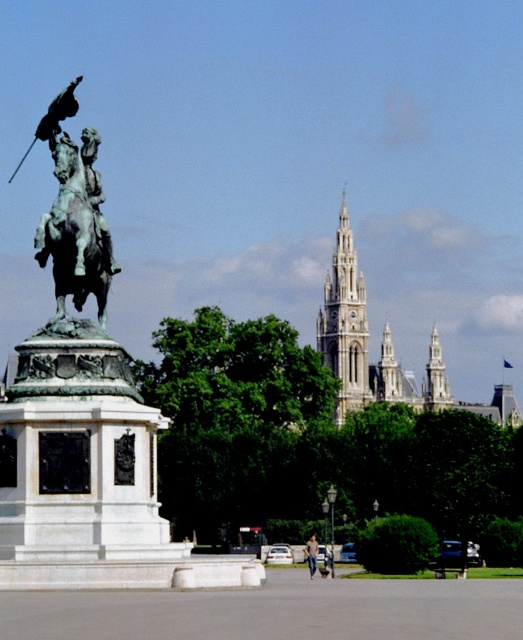
Question: Does bronze statue at left appear on the left side of dark blue jeans at center?

Choices:
 (A) no
 (B) yes

Answer: (B)

Question: Does green stone tower at center appear over dark blue jeans at center?

Choices:
 (A) yes
 (B) no

Answer: (A)

Question: Is the position of green stone tower at center less distant than that of dark blue jeans at center?

Choices:
 (A) no
 (B) yes

Answer: (A)

Question: Among these objects, which one is nearest to the camera?

Choices:
 (A) bronze statue at left
 (B) green patina horse at center
 (C) green stone tower at center
 (D) dark blue jeans at center

Answer: (A)

Question: Which is nearer to the green stone tower at center?

Choices:
 (A) dark blue jeans at center
 (B) bronze statue at left
 (C) green patina horse at center

Answer: (B)

Question: Which of these objects is positioned closest to the green stone tower at center?

Choices:
 (A) bronze statue at left
 (B) dark blue jeans at center
 (C) green patina horse at center

Answer: (A)